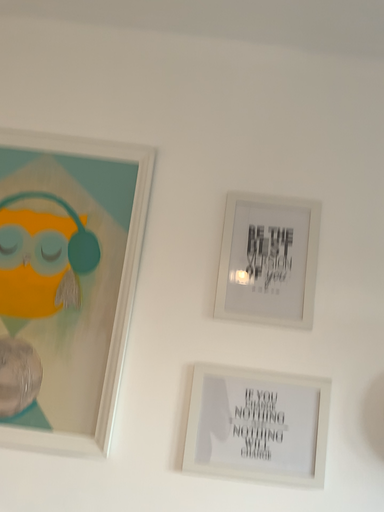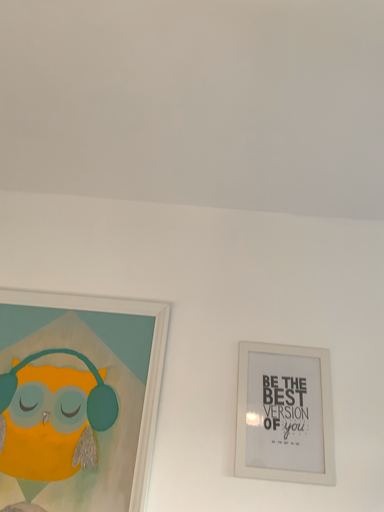
Question: How did the camera likely rotate when shooting the video?

Choices:
 (A) rotated downward
 (B) rotated upward

Answer: (B)